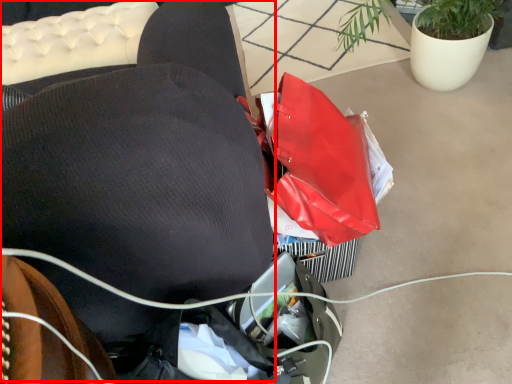
Question: In this image, where is bean bag chair (annotated by the red box) located relative to houseplant?

Choices:
 (A) left
 (B) right

Answer: (A)